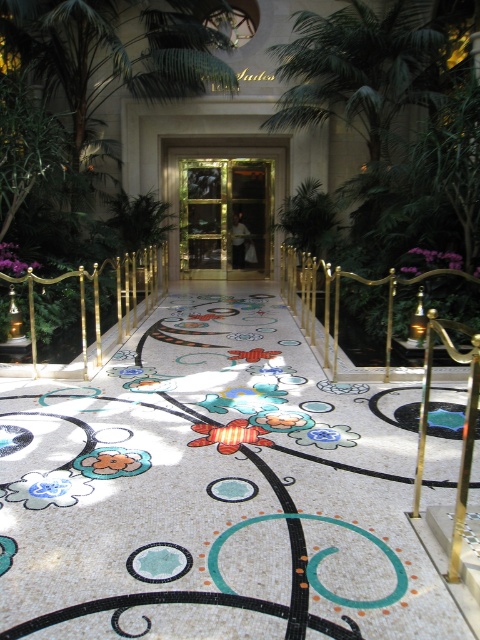
Who is more distant from viewer, (24, 420) or (311, 268)?

Point (311, 268)

Is white mosaic floor at center to the left of gold polished metal railing at center from the viewer's perspective?

Correct, you'll find white mosaic floor at center to the left of gold polished metal railing at center.

Does point (217, 451) come farther from viewer compared to point (301, 321)?

No.

At what (x,y) coordinates should I click in order to perform the action: click on white mosaic floor at center. Please return your answer as a coordinate pair (x, y). Image resolution: width=480 pixels, height=640 pixels. Looking at the image, I should click on (213, 492).

Who is lower down, gold/glass door at center or green leafy plant at center?

green leafy plant at center

Does gold/glass door at center come in front of green leafy plant at center?

No.

Is point (188, 192) closer to camera compared to point (336, 221)?

No, it is not.

This screenshot has width=480, height=640. Identify the location of gold/glass door at center. (225, 218).

Who is taller, gold polished metal railing at center or gold polished metal rail at center?

With more height is gold polished metal rail at center.

Between gold polished metal railing at center and gold polished metal rail at center, which one appears on the left side from the viewer's perspective?

gold polished metal rail at center is more to the left.

I want to click on gold polished metal railing at center, so click(x=335, y=301).